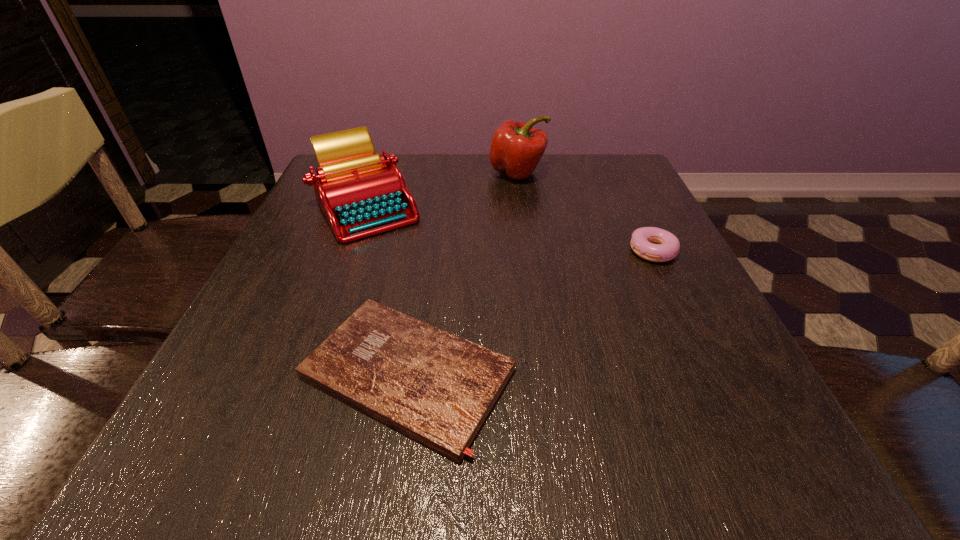
Identify the location of pepper. The height and width of the screenshot is (540, 960). (516, 148).

Locate an element on the screen. The width and height of the screenshot is (960, 540). typewriter is located at coordinates (360, 193).

Where is `the second shortest object`? the second shortest object is located at coordinates (654, 244).

I want to click on doughnut, so click(x=654, y=244).

Identify the location of the nearest object. (438, 388).

What are the coordinates of `Bible` in the screenshot? It's located at (438, 388).

This screenshot has height=540, width=960. I want to click on free space located 0.060m on the right of the pepper, so click(570, 173).

This screenshot has height=540, width=960. I want to click on free location located on the typing side of the typewriter, so click(306, 373).

Find the location of a particular element. This screenshot has width=960, height=540. free location located on the left of the rightmost object is located at coordinates (575, 252).

Locate an element on the screen. The height and width of the screenshot is (540, 960). vacant space located on the left of the Bible is located at coordinates (260, 374).